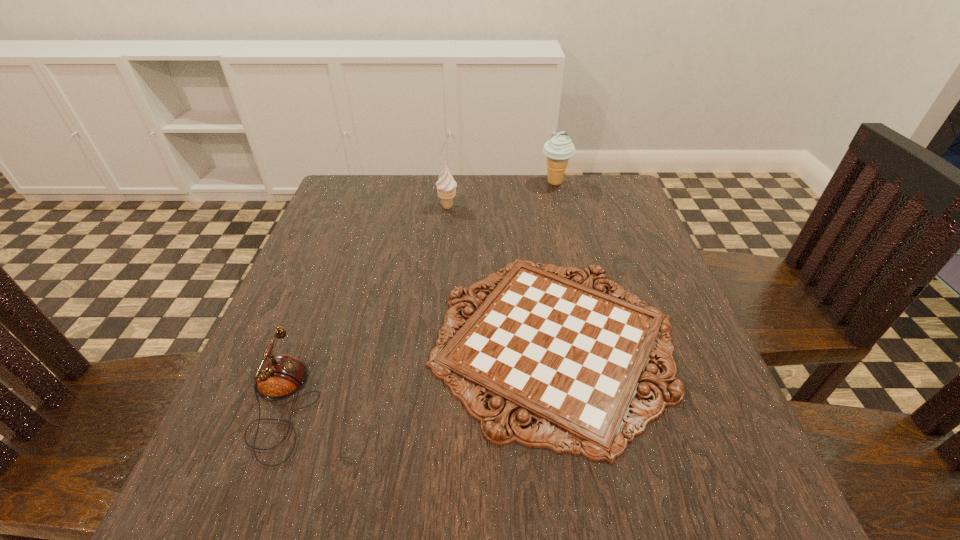
Where is `the tallest object`? Image resolution: width=960 pixels, height=540 pixels. the tallest object is located at coordinates (559, 149).

You are a GUI agent. You are given a task and a screenshot of the screen. Output one action in this format:
    pyautogui.click(x=<x>, y=<y>)
    Task: Click on the farthest object
    This screenshot has height=540, width=960.
    Given the screenshot: What is the action you would take?
    pyautogui.click(x=559, y=149)

The image size is (960, 540). I want to click on the second tallest object, so click(446, 186).

Find the location of `the left icecream`. the left icecream is located at coordinates (446, 186).

The width and height of the screenshot is (960, 540). I want to click on telephone, so click(x=279, y=377).

Find the location of `the second shortest object`. the second shortest object is located at coordinates (279, 377).

Image resolution: width=960 pixels, height=540 pixels. Find the location of `the shortest object`. the shortest object is located at coordinates (561, 352).

Image resolution: width=960 pixels, height=540 pixels. What are the coordinates of `vacant space situated on the front of the taller icecream` in the screenshot? It's located at (567, 234).

What are the coordinates of `vacant area situated 0.110m on the front-facing side of the third nearest object` in the screenshot? It's located at (501, 207).

Where is `free region located 0.400m on the rotary dial of the telephone`? The width and height of the screenshot is (960, 540). free region located 0.400m on the rotary dial of the telephone is located at coordinates (572, 404).